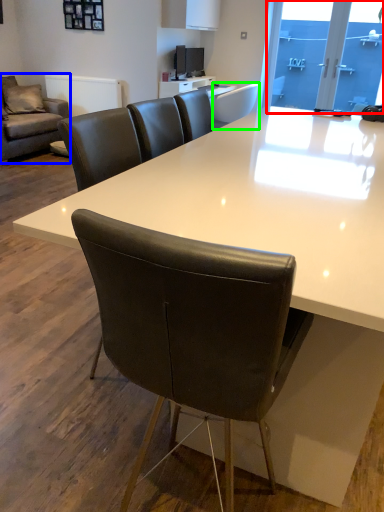
Question: Which is nearer to the window screen (highlighted by a red box)? studio couch (highlighted by a blue box) or chair (highlighted by a green box).

Choices:
 (A) studio couch
 (B) chair

Answer: (B)